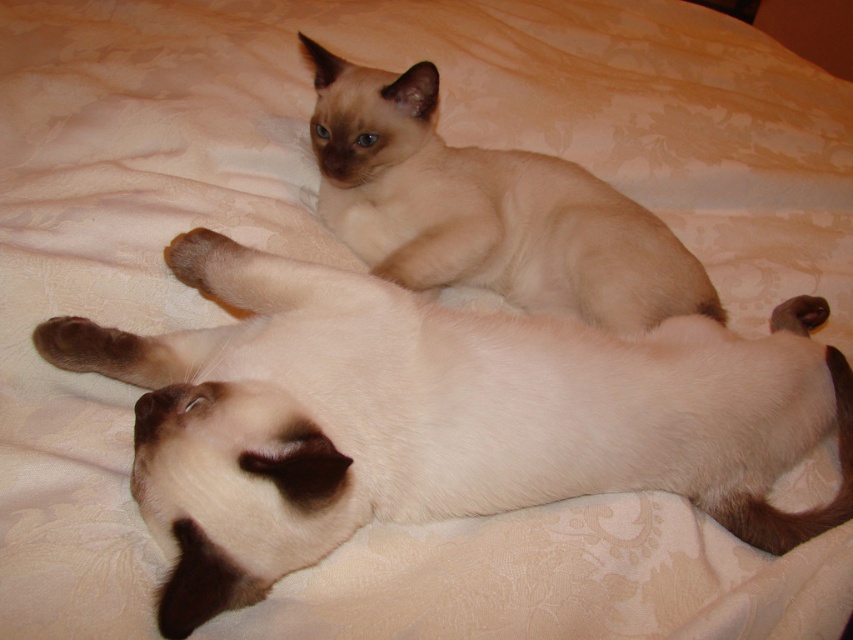
Question: Is matte cream cat at center thinner than light brown fur cat at upper center?

Choices:
 (A) yes
 (B) no

Answer: (B)

Question: Can you confirm if matte cream cat at center is positioned to the right of light brown fur cat at upper center?

Choices:
 (A) yes
 (B) no

Answer: (A)

Question: Does matte cream cat at center appear over light brown fur cat at upper center?

Choices:
 (A) yes
 (B) no

Answer: (B)